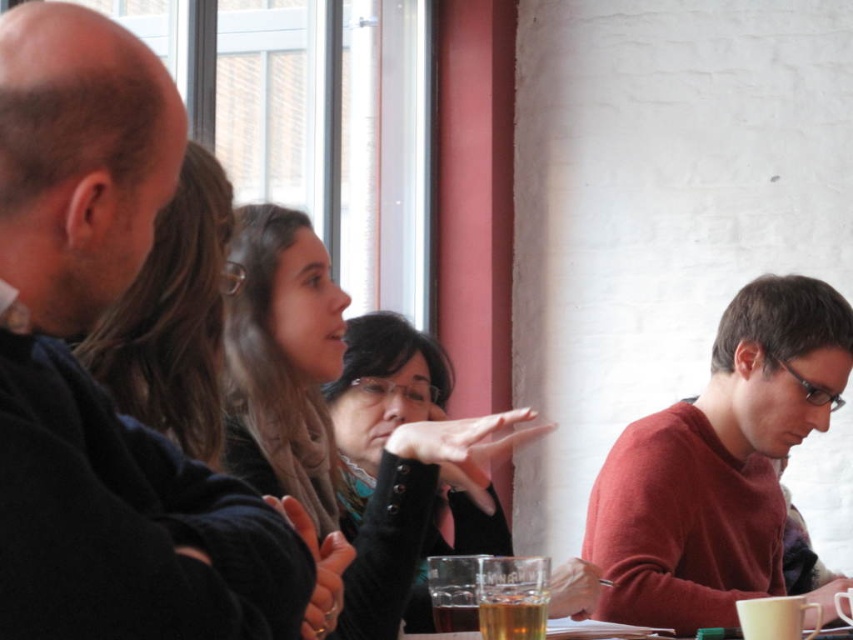
Question: From the image, what is the correct spatial relationship of matte red sweater at right in relation to black matte sweater at center?

Choices:
 (A) left
 (B) right

Answer: (B)

Question: In this image, where is matte red sweater at right located relative to black matte sweater at center?

Choices:
 (A) left
 (B) right

Answer: (B)

Question: Does smooth black shirt at left have a larger size compared to translucent glass beverage at center?

Choices:
 (A) yes
 (B) no

Answer: (A)

Question: Which point is closer to the camera taking this photo?

Choices:
 (A) (831, 616)
 (B) (196, 269)

Answer: (B)

Question: Which object is farther from the camera taking this photo?

Choices:
 (A) matte black hair at upper left
 (B) black matte sweater at center

Answer: (A)

Question: Which of the following is the farthest from the observer?

Choices:
 (A) (700, 570)
 (B) (144, 224)
 (C) (142, 419)

Answer: (A)